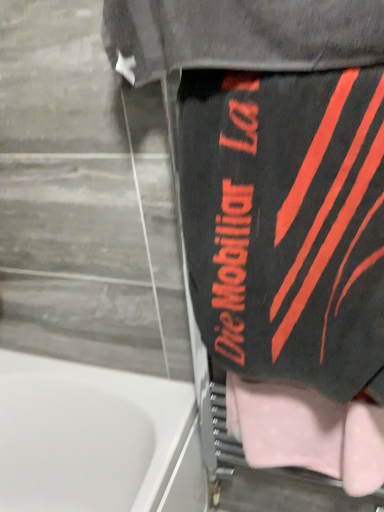
I want to click on pink fabric towel at lower right, so click(x=307, y=432).

The image size is (384, 512). Describe the element at coordinates (307, 432) in the screenshot. I see `pink fabric towel at lower right` at that location.

Locate an element on the screen. The width and height of the screenshot is (384, 512). black matte towel at right is located at coordinates (287, 223).

What do you see at coordinates (287, 223) in the screenshot? The height and width of the screenshot is (512, 384). I see `black matte towel at right` at bounding box center [287, 223].

At what (x,y) coordinates should I click in order to perform the action: click on pink fabric towel at lower right. Please return your answer as a coordinate pair (x, y). Image resolution: width=384 pixels, height=512 pixels. Looking at the image, I should click on (307, 432).

Considering the relative positions of pink fabric towel at lower right and black matte towel at right in the image provided, is pink fabric towel at lower right to the left or to the right of black matte towel at right?

In the image, pink fabric towel at lower right appears on the right side of black matte towel at right.

Is the position of pink fabric towel at lower right less distant than that of black matte towel at right?

No, the depth of pink fabric towel at lower right is greater than that of black matte towel at right.

Does point (241, 422) appear closer or farther from the camera than point (357, 325)?

Point (241, 422).

From the image's perspective, is pink fabric towel at lower right located above or below black matte towel at right?

Clearly, from the image's perspective, pink fabric towel at lower right is below black matte towel at right.

From a real-world perspective, is pink fabric towel at lower right above or below black matte towel at right?

Clearly, from a real-world perspective, pink fabric towel at lower right is below black matte towel at right.

Considering the sizes of pink fabric towel at lower right and black matte towel at right in the image, is pink fabric towel at lower right wider or thinner than black matte towel at right?

Considering their sizes, pink fabric towel at lower right looks slimmer than black matte towel at right.

Who is shorter, pink fabric towel at lower right or black matte towel at right?

pink fabric towel at lower right is shorter.

Based on their sizes in the image, would you say pink fabric towel at lower right is bigger or smaller than black matte towel at right?

pink fabric towel at lower right is smaller than black matte towel at right.

Would you say pink fabric towel at lower right is inside or outside black matte towel at right?

pink fabric towel at lower right is spatially situated outside black matte towel at right.

Is pink fabric towel at lower right not near black matte towel at right?

That's not correct — pink fabric towel at lower right is a little close to black matte towel at right.

Is pink fabric towel at lower right oriented away from black matte towel at right?

pink fabric towel at lower right does not have its back to black matte towel at right.

Where is `towel on the right of black matte towel at right`? The image size is (384, 512). towel on the right of black matte towel at right is located at coordinates (307, 432).

Is black matte towel at right to the left of pink fabric towel at lower right from the viewer's perspective?

Yes.

Which object is further away from the camera taking this photo, black matte towel at right or pink fabric towel at lower right?

pink fabric towel at lower right is more distant.

Which point is more distant from viewer, (333, 84) or (295, 398)?

Positioned behind is point (295, 398).

From the image's perspective, is black matte towel at right above or below pink fabric towel at lower right?

From the image's perspective, black matte towel at right appears above pink fabric towel at lower right.

In the scene shown: From a real-world perspective, which object stands above the other?

black matte towel at right.

Between black matte towel at right and pink fabric towel at lower right, which one has larger width?

black matte towel at right is wider.

From their relative heights in the image, would you say black matte towel at right is taller or shorter than pink fabric towel at lower right?

black matte towel at right is taller than pink fabric towel at lower right.

Is black matte towel at right smaller than pink fabric towel at lower right?

Actually, black matte towel at right might be larger than pink fabric towel at lower right.

Is black matte towel at right outside of pink fabric towel at lower right?

black matte towel at right lies outside pink fabric towel at lower right's area.

Are black matte towel at right and pink fabric towel at lower right located far from each other?

No.

Could you tell me if black matte towel at right is turned towards pink fabric towel at lower right?

No, black matte towel at right does not turn towards pink fabric towel at lower right.

What's the angular difference between black matte towel at right and pink fabric towel at lower right's facing directions?

The facing directions of black matte towel at right and pink fabric towel at lower right are 0.00259 degrees apart.

You are a GUI agent. You are given a task and a screenshot of the screen. Output one action in this format:
    pyautogui.click(x=<x>, y=<y>)
    Task: Click on the towel directly beneath the black matte towel at right (from a real-world perspective)
    Image resolution: width=384 pixels, height=512 pixels.
    Given the screenshot: What is the action you would take?
    pyautogui.click(x=307, y=432)

This screenshot has width=384, height=512. I want to click on towel below the black matte towel at right (from a real-world perspective), so click(307, 432).

Where is `underclothes lying above the pink fabric towel at lower right (from the image's perspective)`? underclothes lying above the pink fabric towel at lower right (from the image's perspective) is located at coordinates (287, 223).